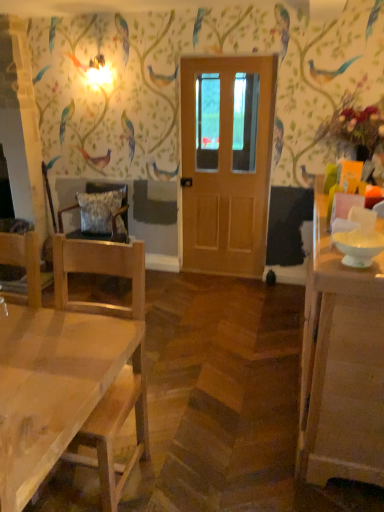
Question: Considering the relative sizes of white glossy cabinet at right and wooden chair with cushion at left, the second chair when ordered from front to back, in the image provided, is white glossy cabinet at right taller than wooden chair with cushion at left, the second chair when ordered from front to back,?

Choices:
 (A) yes
 (B) no

Answer: (A)

Question: Considering the relative sizes of white glossy cabinet at right and wooden chair with cushion at left, the second chair when ordered from front to back, in the image provided, is white glossy cabinet at right shorter than wooden chair with cushion at left, the second chair when ordered from front to back,?

Choices:
 (A) no
 (B) yes

Answer: (A)

Question: Considering the relative sizes of white glossy cabinet at right and wooden chair with cushion at left, the second chair when ordered from front to back, in the image provided, is white glossy cabinet at right smaller than wooden chair with cushion at left, the second chair when ordered from front to back,?

Choices:
 (A) no
 (B) yes

Answer: (A)

Question: From the image's perspective, would you say white glossy cabinet at right is positioned over wooden chair with cushion at left, the second chair when ordered from front to back?

Choices:
 (A) no
 (B) yes

Answer: (A)

Question: Does white glossy cabinet at right have a larger size compared to wooden chair with cushion at left, placed as the first chair when sorted from back to front?

Choices:
 (A) yes
 (B) no

Answer: (A)

Question: Is white glossy cabinet at right looking in the opposite direction of wooden chair with cushion at left, placed as the first chair when sorted from back to front?

Choices:
 (A) no
 (B) yes

Answer: (A)

Question: Is wooden door at center not near white glossy cabinet at right?

Choices:
 (A) no
 (B) yes

Answer: (B)

Question: Does wooden door at center have a greater height compared to white glossy cabinet at right?

Choices:
 (A) no
 (B) yes

Answer: (B)

Question: Does wooden door at center turn towards white glossy cabinet at right?

Choices:
 (A) yes
 (B) no

Answer: (B)

Question: Is the surface of wooden door at center in direct contact with white glossy cabinet at right?

Choices:
 (A) yes
 (B) no

Answer: (B)

Question: Is wooden door at center further to the viewer compared to white glossy cabinet at right?

Choices:
 (A) yes
 (B) no

Answer: (A)

Question: Is wooden door at center outside white glossy cabinet at right?

Choices:
 (A) no
 (B) yes

Answer: (B)

Question: Does wooden chair with cushion at left, the second chair when ordered from front to back, come behind white glossy cabinet at right?

Choices:
 (A) no
 (B) yes

Answer: (B)